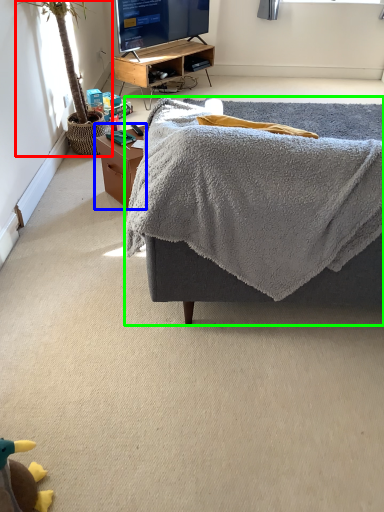
Question: Considering the real-world distances, which object is farthest from houseplant (highlighted by a red box)? table (highlighted by a blue box) or furniture (highlighted by a green box)?

Choices:
 (A) table
 (B) furniture

Answer: (B)